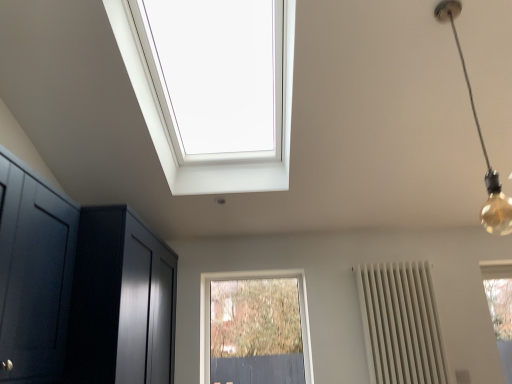
The image size is (512, 384). I want to click on gold bulb at upper right, so click(481, 144).

Find the location of a particular element. The height and width of the screenshot is (384, 512). white matte radiator at right is located at coordinates (401, 323).

Where is `glossy dark wood dresser at left`? The image size is (512, 384). glossy dark wood dresser at left is located at coordinates (81, 289).

At what (x,y) coordinates should I click in order to perform the action: click on clear glass window at center. Please return your answer as a coordinate pair (x, y). Looking at the image, I should click on (251, 278).

Where is `radiator below the glossy dark wood dresser at left (from the image's perspective)`? The width and height of the screenshot is (512, 384). radiator below the glossy dark wood dresser at left (from the image's perspective) is located at coordinates (401, 323).

From the picture: Choose the correct answer: Is white matte radiator at right inside glossy dark wood dresser at left or outside it?

The correct answer is: outside.

Considering the relative sizes of white matte radiator at right and glossy dark wood dresser at left in the image provided, is white matte radiator at right smaller than glossy dark wood dresser at left?

Correct, white matte radiator at right occupies less space than glossy dark wood dresser at left.

Considering the sizes of gold bulb at upper right and clear glass window at center in the image, is gold bulb at upper right wider or thinner than clear glass window at center?

Clearly, gold bulb at upper right has more width compared to clear glass window at center.

Between gold bulb at upper right and clear glass window at center, which one appears on the right side from the viewer's perspective?

gold bulb at upper right is more to the right.

Consider the image. Is gold bulb at upper right facing towards clear glass window at center?

No, gold bulb at upper right does not turn towards clear glass window at center.

From the image's perspective, is gold bulb at upper right below clear glass window at center?

No, from the image's perspective, gold bulb at upper right is not beneath clear glass window at center.

Between clear glass window at center and glossy dark wood dresser at left, which one has less height?

clear glass window at center.

Find the location of a particular element. The width and height of the screenshot is (512, 384). window behind the glossy dark wood dresser at left is located at coordinates (251, 278).

Is clear glass window at center beside glossy dark wood dresser at left?

No, clear glass window at center is not next to glossy dark wood dresser at left.

Does clear glass window at center come in front of glossy dark wood dresser at left?

No, it is not.

From a real-world perspective, is glossy dark wood dresser at left physically located above or below gold bulb at upper right?

glossy dark wood dresser at left is below gold bulb at upper right.

Considering the sizes of objects glossy dark wood dresser at left and gold bulb at upper right in the image provided, who is shorter, glossy dark wood dresser at left or gold bulb at upper right?

Standing shorter between the two is glossy dark wood dresser at left.

Considering the positions of objects glossy dark wood dresser at left and gold bulb at upper right in the image provided, who is in front, glossy dark wood dresser at left or gold bulb at upper right?

gold bulb at upper right is closer to the camera.

Is glossy dark wood dresser at left wider than gold bulb at upper right?

Yes.

Does gold bulb at upper right appear on the right side of white matte radiator at right?

No.

Is the depth of gold bulb at upper right greater than that of white matte radiator at right?

Answer: No, it is not.

From the image's perspective, is gold bulb at upper right on white matte radiator at right?

Yes, from the image's perspective, gold bulb at upper right is above white matte radiator at right.

Does gold bulb at upper right touch white matte radiator at right?

No, gold bulb at upper right is not touching white matte radiator at right.

Looking at this image, is white matte radiator at right located outside gold bulb at upper right?

That's correct, white matte radiator at right is outside of gold bulb at upper right.

From a real-world perspective, is white matte radiator at right over gold bulb at upper right?

No, from a real-world perspective, white matte radiator at right is not above gold bulb at upper right.

Is point (426, 363) closer to viewer compared to point (461, 56)?

No, (426, 363) is further to viewer.

From the image's perspective, is clear glass window at center beneath gold bulb at upper right?

Correct, clear glass window at center appears lower than gold bulb at upper right in the image.

This screenshot has width=512, height=384. Identify the location of light fixture located above the clear glass window at center (from a real-world perspective). (481, 144).

Does clear glass window at center turn towards gold bulb at upper right?

Yes, clear glass window at center is facing gold bulb at upper right.

From a real-world perspective, is clear glass window at center physically above gold bulb at upper right?

No.

Locate an element on the screen. Image resolution: width=512 pixels, height=384 pixels. radiator that appears below the glossy dark wood dresser at left (from the image's perspective) is located at coordinates (401, 323).

Image resolution: width=512 pixels, height=384 pixels. Identify the location of light fixture that is above the clear glass window at center (from the image's perspective). (481, 144).

Which object lies further to the anchor point gold bulb at upper right, clear glass window at center or white matte radiator at right?

clear glass window at center.

Which object lies further to the anchor point clear glass window at center, white matte radiator at right or gold bulb at upper right?

gold bulb at upper right lies further to clear glass window at center than the other object.

From the image, which object appears to be nearer to glossy dark wood dresser at left, gold bulb at upper right or white matte radiator at right?

The object closer to glossy dark wood dresser at left is white matte radiator at right.

Looking at the image, which one is located closer to gold bulb at upper right, white matte radiator at right or glossy dark wood dresser at left?

white matte radiator at right.

Considering their positions, is clear glass window at center positioned further to glossy dark wood dresser at left than white matte radiator at right?

white matte radiator at right is positioned further to the anchor glossy dark wood dresser at left.

Considering their positions, is glossy dark wood dresser at left positioned further to clear glass window at center than white matte radiator at right?

Among the two, glossy dark wood dresser at left is located further to clear glass window at center.

When comparing their distances from white matte radiator at right, does gold bulb at upper right or clear glass window at center seem closer?

The object closer to white matte radiator at right is clear glass window at center.

Based on their spatial positions, is white matte radiator at right or clear glass window at center closer to gold bulb at upper right?

white matte radiator at right is positioned closer to the anchor gold bulb at upper right.

This screenshot has width=512, height=384. In order to click on dresser between gold bulb at upper right and clear glass window at center in the front-back direction in this screenshot , I will do `click(81, 289)`.

Locate an element on the screen. The image size is (512, 384). window between glossy dark wood dresser at left and white matte radiator at right is located at coordinates coord(251,278).

The height and width of the screenshot is (384, 512). What are the coordinates of `radiator located between gold bulb at upper right and clear glass window at center in the depth direction` in the screenshot? It's located at (401, 323).

Locate an element on the screen. light fixture situated between glossy dark wood dresser at left and white matte radiator at right from left to right is located at coordinates (481, 144).